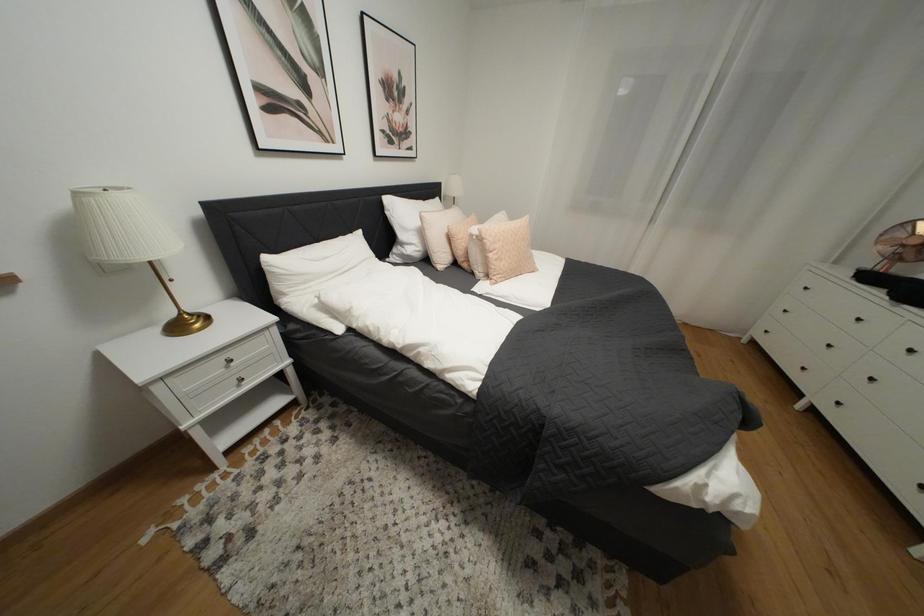
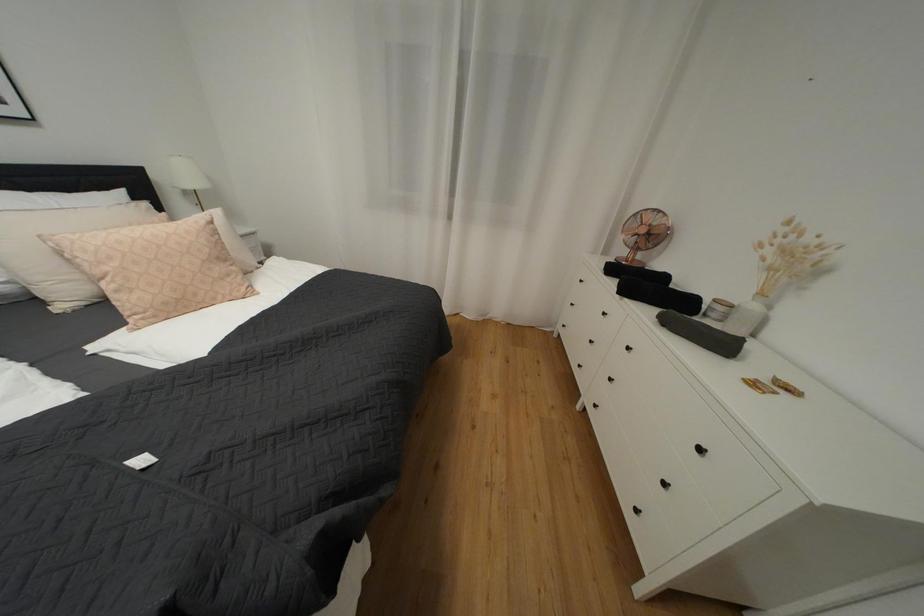
Question: The images are taken continuously from a first-person perspective. In which direction are you moving?

Choices:
 (A) Left
 (B) Right
 (C) Forward
 (D) Backward

Answer: (B)